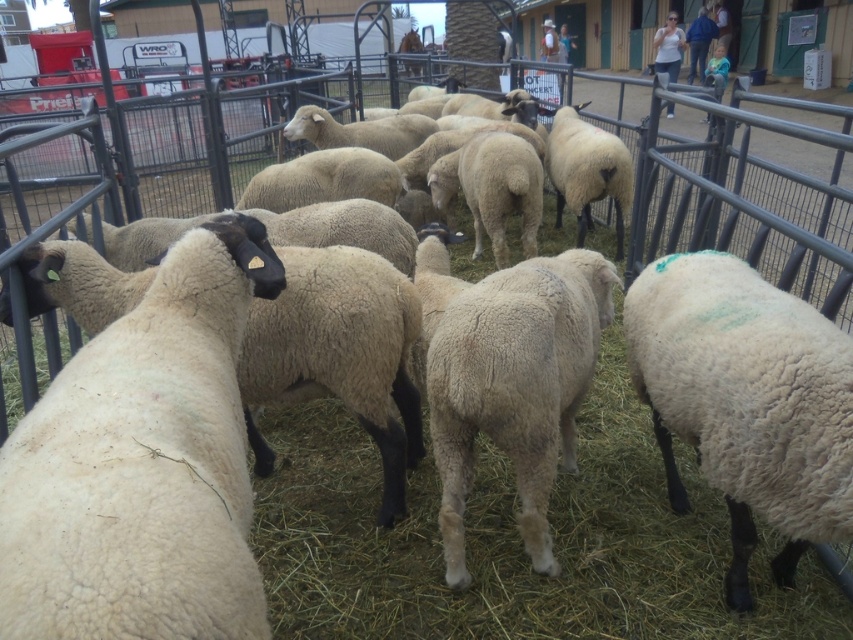
Question: Does white woolen sheep at right have a lesser width compared to white woolen sheep at center?

Choices:
 (A) yes
 (B) no

Answer: (A)

Question: Can you confirm if white woolen sheep at left is positioned below white woolen sheep at center?

Choices:
 (A) yes
 (B) no

Answer: (B)

Question: Estimate the real-world distances between objects in this image. Which object is closer to the white woolen sheep at left?

Choices:
 (A) white woolen sheep at right
 (B) white woolen sheep at center

Answer: (B)

Question: Estimate the real-world distances between objects in this image. Which object is farther from the white woolen sheep at left?

Choices:
 (A) white woolen sheep at right
 (B) white woolen sheep at center

Answer: (A)

Question: Which object appears closest to the camera in this image?

Choices:
 (A) white woolen sheep at center
 (B) white woolen sheep at left

Answer: (B)

Question: Is white woolen sheep at right smaller than white woolen sheep at center?

Choices:
 (A) no
 (B) yes

Answer: (B)